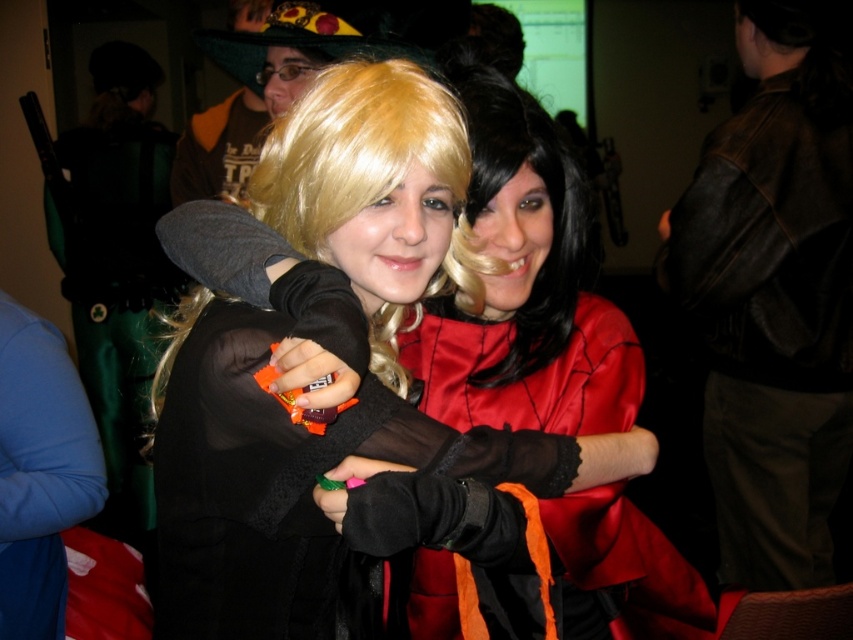
Who is taller, shiny satin dress at center or satin red dress at center?

shiny satin dress at center is taller.

Who is higher up, shiny satin dress at center or satin red dress at center?

shiny satin dress at center is above.

Is point (531, 387) positioned after point (618, 538)?

That is True.

Where is `shiny satin dress at center`? The width and height of the screenshot is (853, 640). shiny satin dress at center is located at coordinates (524, 291).

I want to click on velvet black gloves at center, so click(292, 492).

Is shiny satin dress at center wider than velvet black gloves at center?

Correct, the width of shiny satin dress at center exceeds that of velvet black gloves at center.

Does point (509, 168) come in front of point (193, 444)?

No, (509, 168) is further to viewer.

This screenshot has width=853, height=640. Describe the element at coordinates (524, 291) in the screenshot. I see `shiny satin dress at center` at that location.

Find the location of a particular element. shiny satin dress at center is located at coordinates (524, 291).